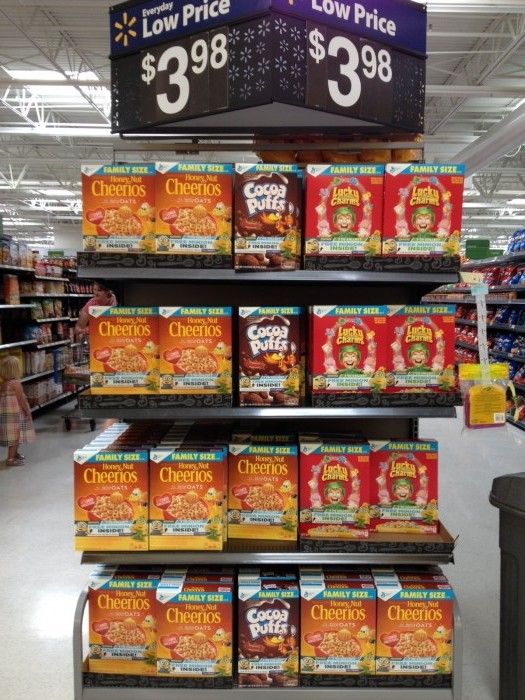
Find the location of a particular element. The image size is (525, 700). lucky charm cereal boxes is located at coordinates [333, 460], [404, 477], [352, 369], [401, 346], [436, 229], [341, 241], [340, 437].